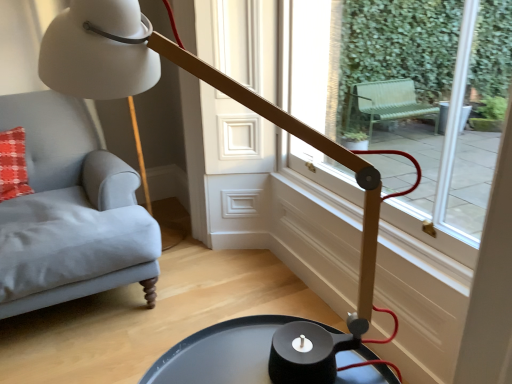
Where is `free point above black matte tray at lower center (from a real-world perspective)`? free point above black matte tray at lower center (from a real-world perspective) is located at coordinates (232, 357).